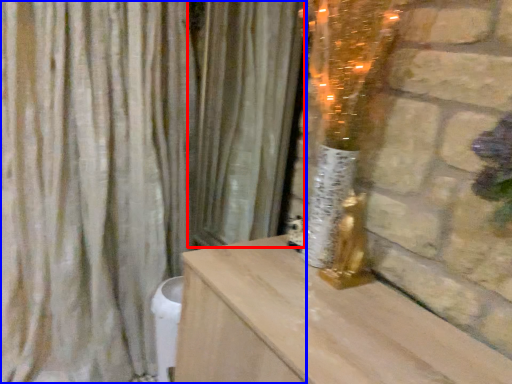
Question: Which object is further to the camera taking this photo, curtain (highlighted by a red box) or curtain (highlighted by a blue box)?

Choices:
 (A) curtain
 (B) curtain

Answer: (A)